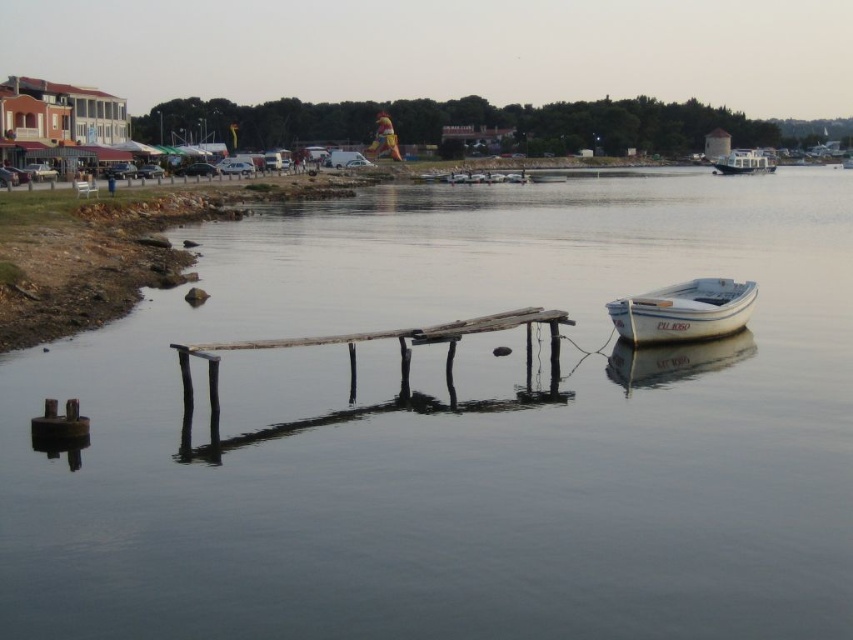
Question: Where is white matte boat at lower right located in relation to white glossy houseboat at upper right in the image?

Choices:
 (A) left
 (B) right

Answer: (A)

Question: Which point is farther from the camera taking this photo?

Choices:
 (A) (352, 412)
 (B) (241, 342)
 (C) (718, 305)
 (D) (729, 163)

Answer: (D)

Question: Which of the following is the closest to the observer?

Choices:
 (A) (728, 332)
 (B) (772, 170)
 (C) (409, 348)
 (D) (143, 604)

Answer: (D)

Question: Can you confirm if transparent water at center is positioned below white matte boat at lower right?

Choices:
 (A) no
 (B) yes

Answer: (A)

Question: Does white matte boat at lower right have a lesser width compared to white glossy houseboat at upper right?

Choices:
 (A) yes
 (B) no

Answer: (A)

Question: Which point is closer to the camera taking this photo?

Choices:
 (A) (183, 400)
 (B) (6, 461)
 (C) (749, 172)

Answer: (B)